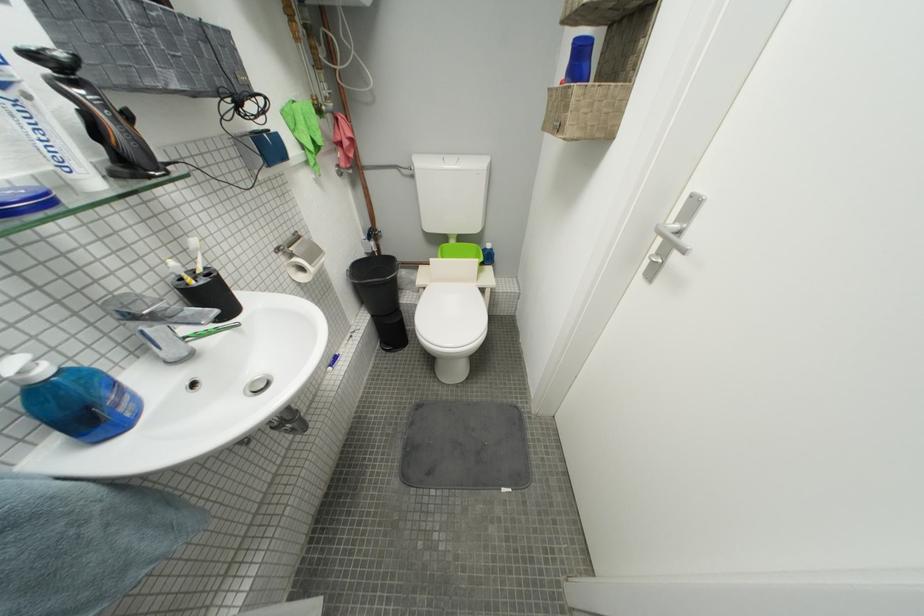
Find where to lift the chrome faucet handle. Please return your answer as a coordinate pair (x, y).

(153, 310)